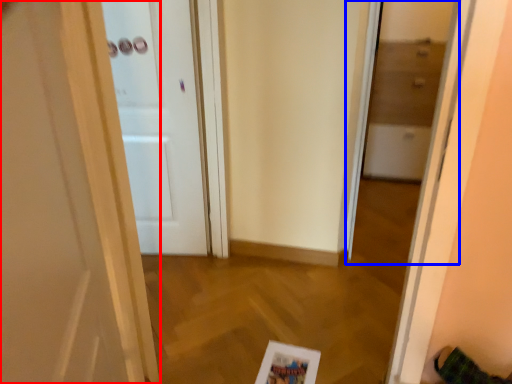
Question: Among these objects, which one is nearest to the camera, door (highlighted by a red box) or glass door (highlighted by a blue box)?

Choices:
 (A) door
 (B) glass door

Answer: (A)